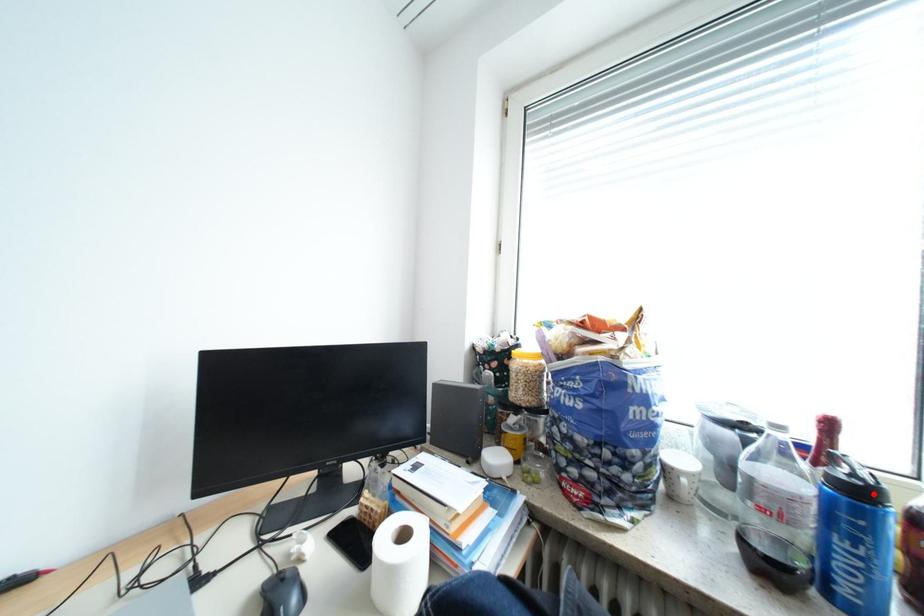
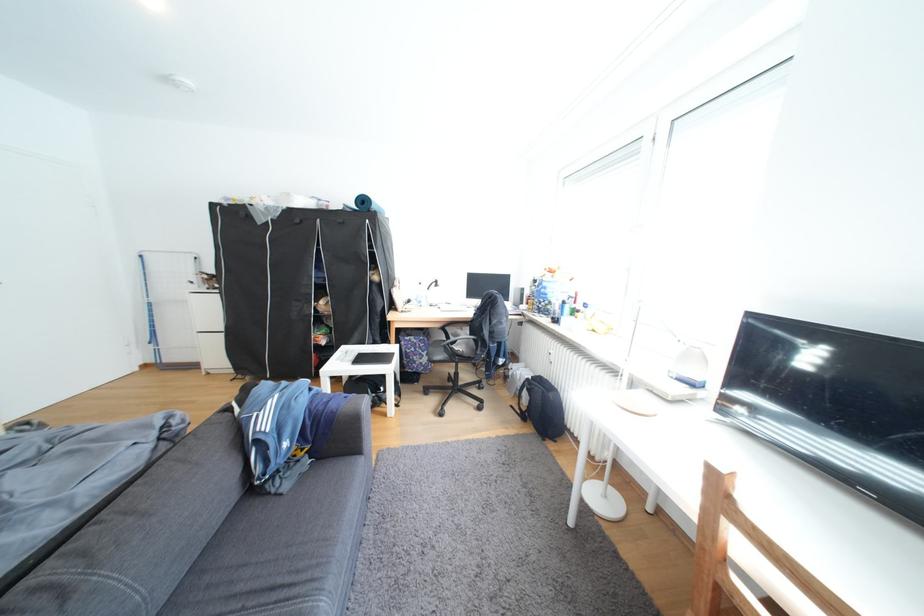
Question: I am providing you with two images of the same scene from different viewpoints. A red point is marked on the first image. At the location where the point appears in image 1, is it still visible in image 2?

Choices:
 (A) Yes
 (B) No

Answer: (B)